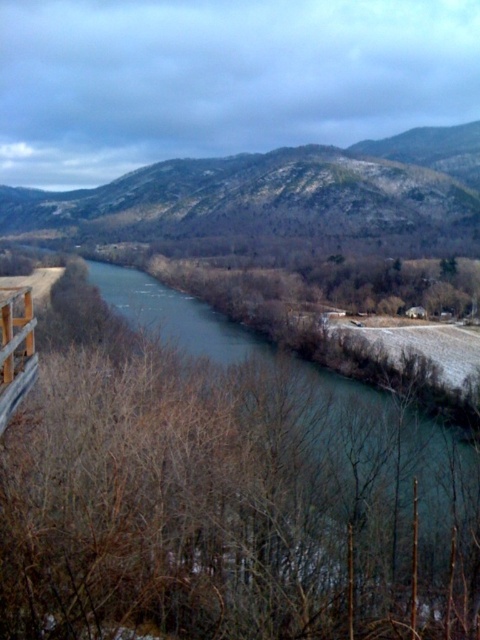
Question: Considering the relative positions of gray rocky mountain at center and greenish-blue water at center in the image provided, where is gray rocky mountain at center located with respect to greenish-blue water at center?

Choices:
 (A) above
 (B) below

Answer: (A)

Question: Is gray rocky mountain at center positioned behind greenish-blue water at center?

Choices:
 (A) yes
 (B) no

Answer: (A)

Question: Where is gray rocky mountain at center located in relation to greenish-blue water at center in the image?

Choices:
 (A) right
 (B) left

Answer: (A)

Question: Which of the following is the closest to the observer?

Choices:
 (A) (444, 228)
 (B) (427, 481)

Answer: (B)

Question: Which object appears closest to the camera in this image?

Choices:
 (A) gray rocky mountain at center
 (B) greenish-blue water at center

Answer: (B)